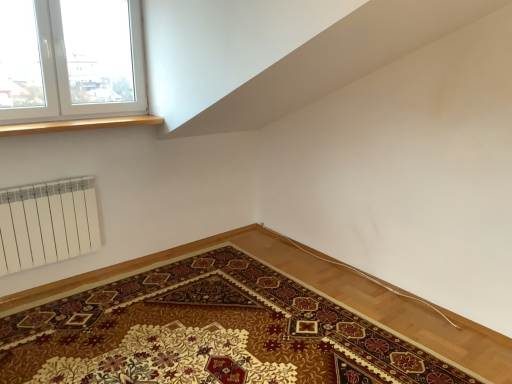
Question: Based on their sizes in the image, would you say white plastic window at upper left is bigger or smaller than carpeted mat at lower left?

Choices:
 (A) small
 (B) big

Answer: (A)

Question: Considering the positions of white plastic window at upper left and carpeted mat at lower left in the image, is white plastic window at upper left wider or thinner than carpeted mat at lower left?

Choices:
 (A) wide
 (B) thin

Answer: (B)

Question: Estimate the real-world distances between objects in this image. Which object is closer to the wooden at upper left?

Choices:
 (A) carpeted mat at lower left
 (B) white plastic window at upper left

Answer: (B)

Question: Which object is positioned farthest from the wooden at upper left?

Choices:
 (A) white plastic window at upper left
 (B) carpeted mat at lower left

Answer: (B)